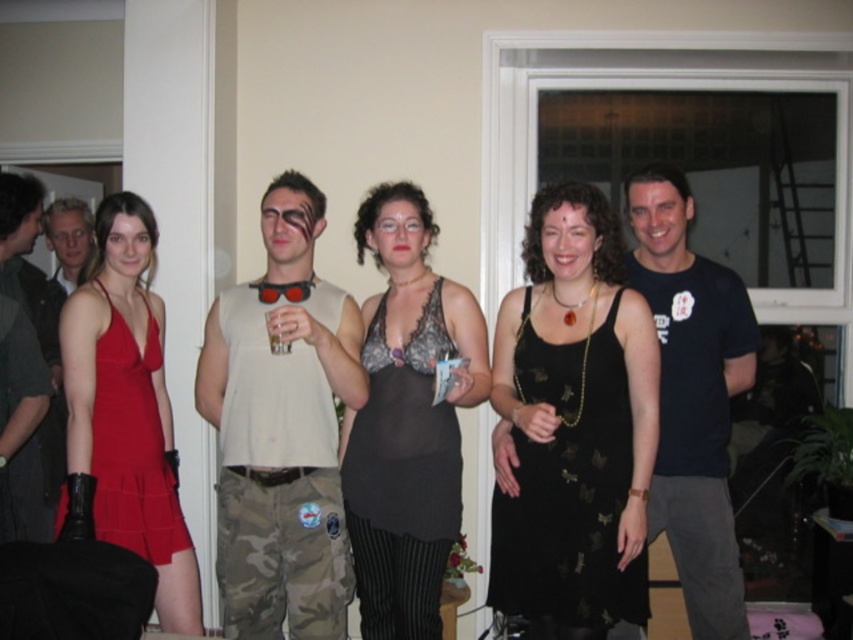
You are standing at the position of the point at coordinates (281, 429) in the image. Which person are you closest to?

The point at coordinates (281, 429) is on camouflage pants at center, so you are closest to the man in beige sleeveless top and camouflage pants.

You are organizing a photo shoot and need to ensure that the black lace top at center and the black lace dress at center can fit side by side on a mannequin stand. The stand can only accommodate items with a combined width of 40 cm. Given their widths, will both items fit together?

The black lace top at center has a larger width than the black lace dress at center. However, since the exact widths aren not provided, we cannot determine if their combined width exceeds 40 cm. Please provide the specific measurements for an accurate assessment.